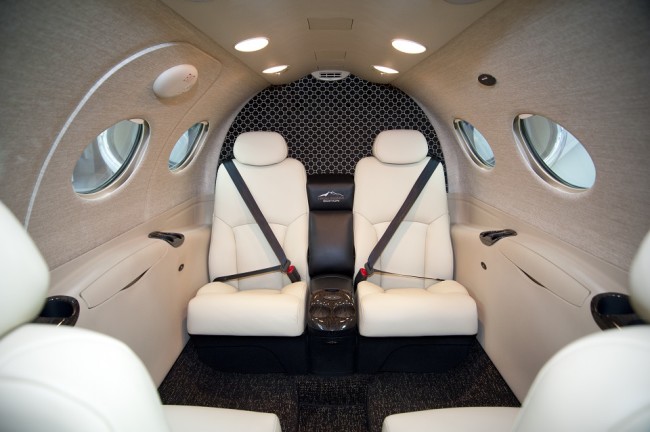
Locate an element on the screen. headrest is located at coordinates (270, 148).